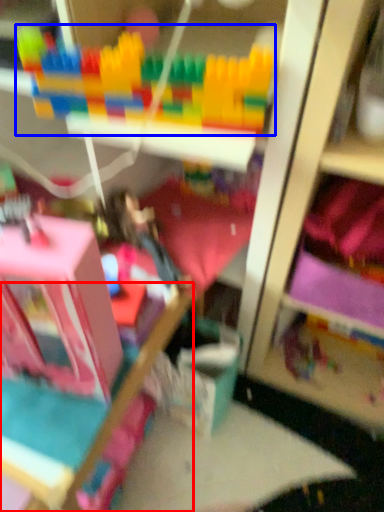
Question: Which object is further to the camera taking this photo, bed frame (highlighted by a red box) or toy (highlighted by a blue box)?

Choices:
 (A) bed frame
 (B) toy

Answer: (A)